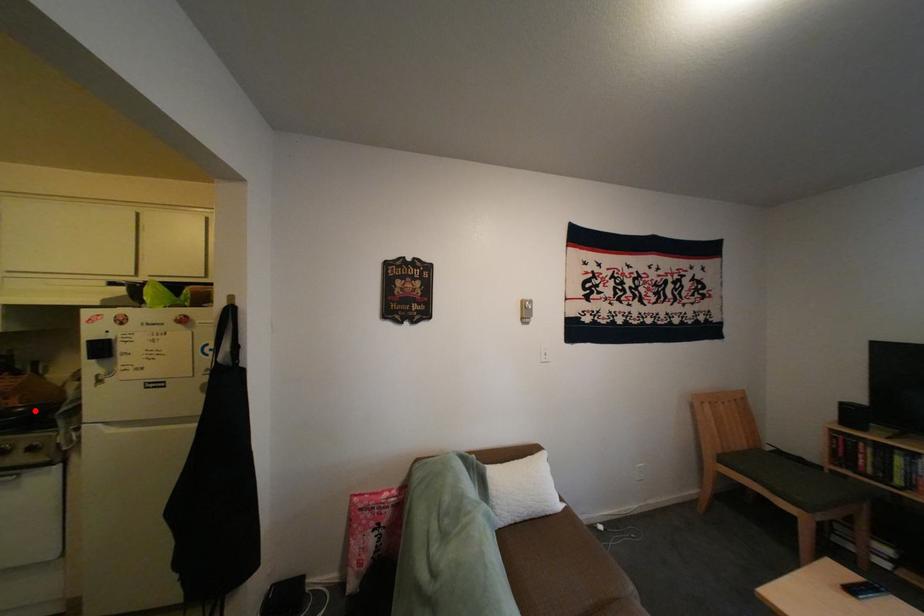
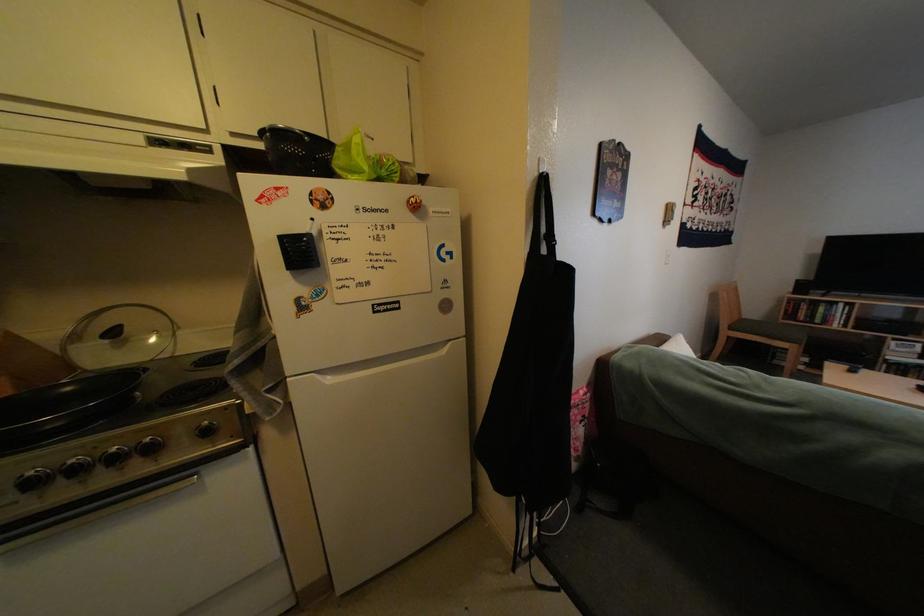
Question: A red point is marked in image1. In image2, is the corresponding 3D point closer to the camera or farther? Reply with the corresponding letter.

Choices:
 (A) The corresponding 3D point is closer.
 (B) The corresponding 3D point is farther.

Answer: (B)